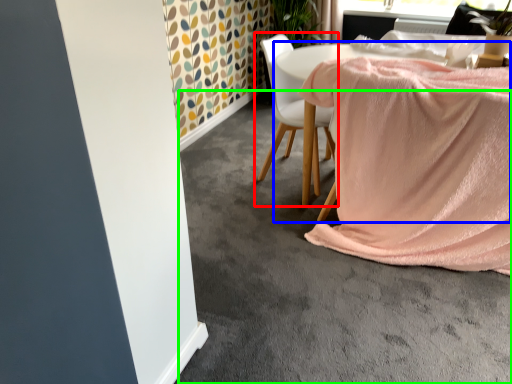
Question: Considering the real-world distances, which object is farthest from chair (highlighted by a red box)? table (highlighted by a blue box) or concrete (highlighted by a green box)?

Choices:
 (A) table
 (B) concrete

Answer: (B)